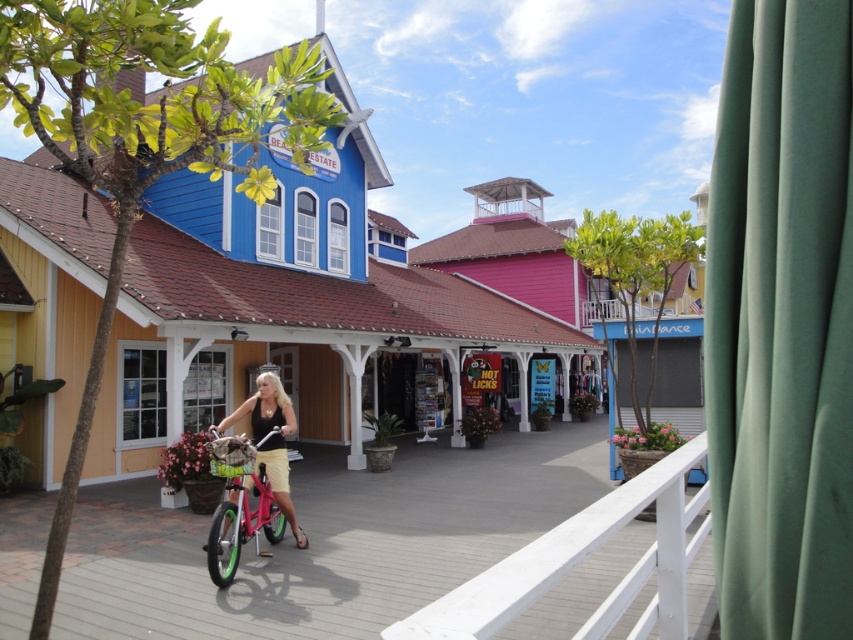
Who is lower down, white wooden rail at center or matte black tank top at center?

Positioned lower is matte black tank top at center.

Is white wooden rail at center positioned behind matte black tank top at center?

No, it is in front of matte black tank top at center.

What do you see at coordinates (583, 560) in the screenshot? Image resolution: width=853 pixels, height=640 pixels. I see `white wooden rail at center` at bounding box center [583, 560].

You are a GUI agent. You are given a task and a screenshot of the screen. Output one action in this format:
    pyautogui.click(x=<x>, y=<y>)
    Task: Click on the white wooden rail at center
    
    Given the screenshot: What is the action you would take?
    click(x=583, y=560)